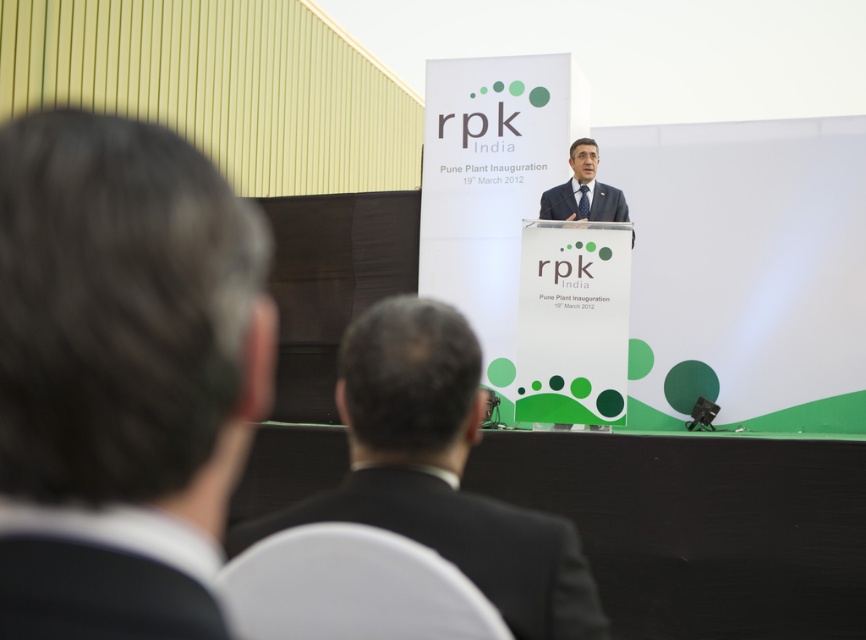
You are attending the rpk India Pune Plant Inauguration on 19th March 2012 and want to take a photo of the two points marked in the image. Which point, point (408,337) or point (580,214), is closer to you?

Point (408,337) is closer to the viewer than point (580,214), so you should focus your camera on point (408,337) first as it is nearer.

You are a photographer at the event and need to capture a clear photo of both the black matte suit at lower left and the dark gray suit at center. Can you position yourself so that neither of them blocks the other in the photo?

Yes, since the black matte suit at lower left is in front of the dark gray suit at center, you can position yourself behind the black matte suit at lower left to ensure both are visible without obstruction.